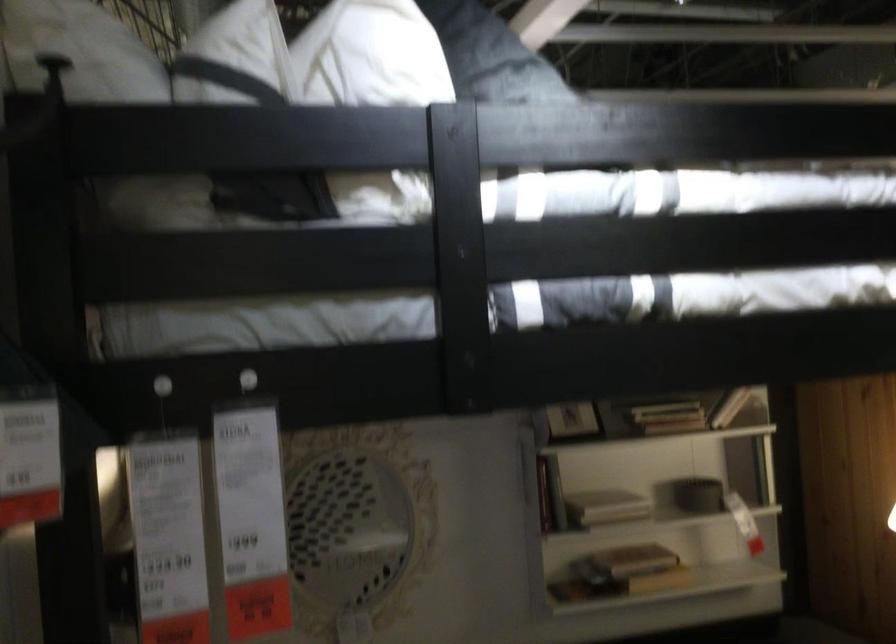
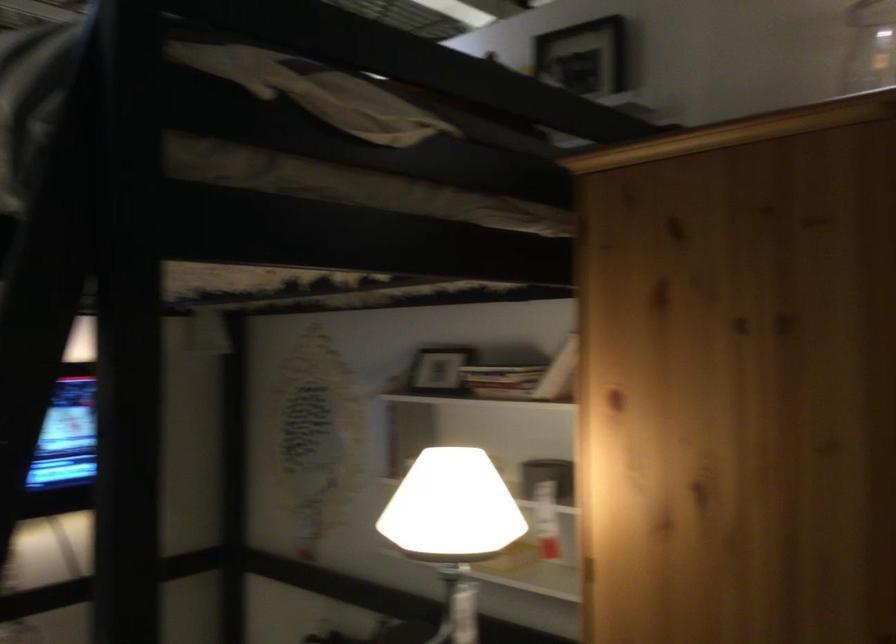
The point at (588, 417) is marked in the first image. Where is the corresponding point in the second image?

(435, 372)